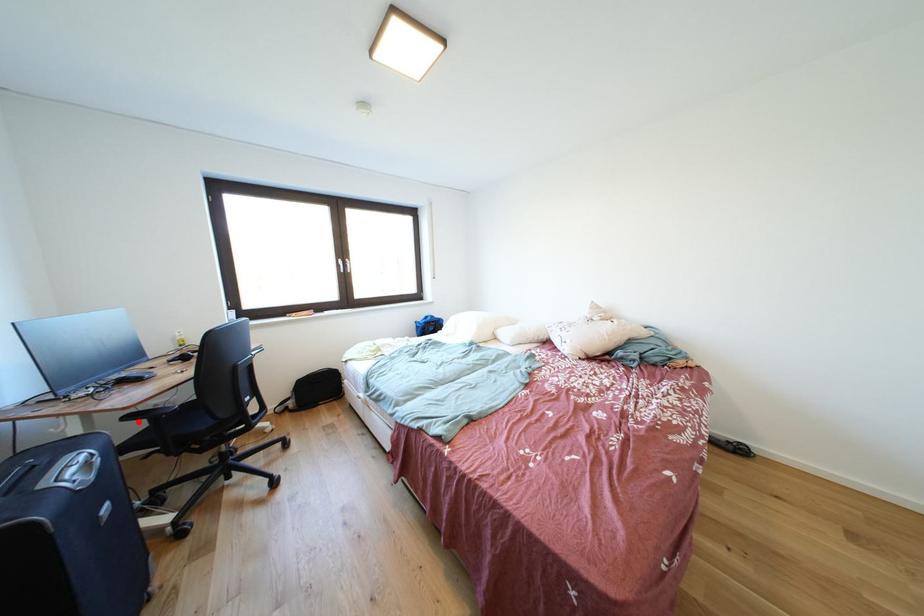
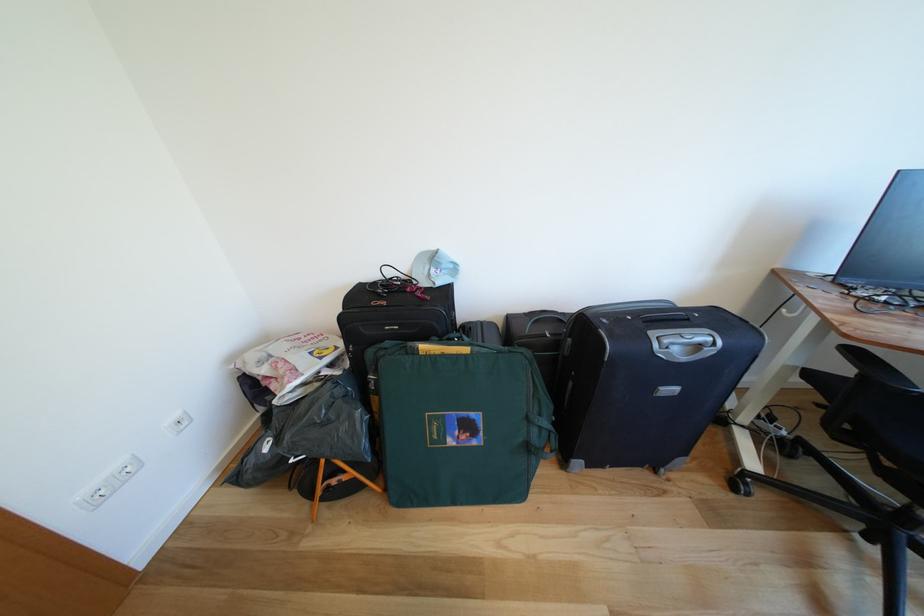
Find the pixel in the second image that matches the highlighted location in the first image.

(862, 357)